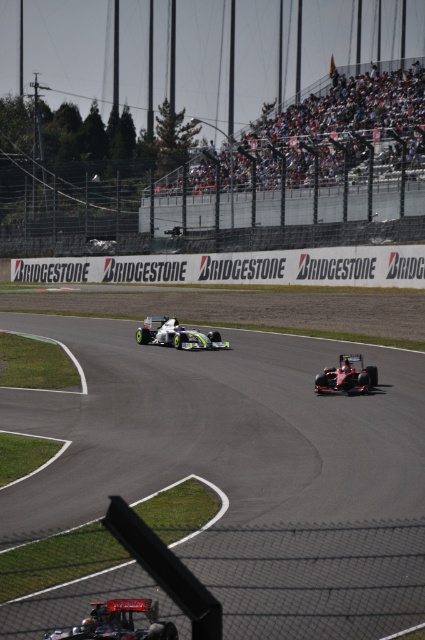
Question: Which object is farther from the camera taking this photo?

Choices:
 (A) green rubber tire at center
 (B) black rubber tire at lower center
 (C) black rubber tire at center

Answer: (A)

Question: Is green rubber tire at center smaller than black rubber tire at lower center?

Choices:
 (A) no
 (B) yes

Answer: (A)

Question: Can you confirm if green matte race car at center is bigger than black rubber tire at center?

Choices:
 (A) no
 (B) yes

Answer: (B)

Question: Estimate the real-world distances between objects in this image. Which object is closer to the black rubber tire at center?

Choices:
 (A) green matte race car at center
 (B) smooth asphalt track at center
 (C) green rubber tire at center

Answer: (A)

Question: Estimate the real-world distances between objects in this image. Which object is closer to the smooth asphalt track at center?

Choices:
 (A) black rubber tire at lower center
 (B) green matte race car at center
 (C) black rubber tire at center

Answer: (A)

Question: Is black rubber tire at lower center wider than black rubber tire at center?

Choices:
 (A) no
 (B) yes

Answer: (A)